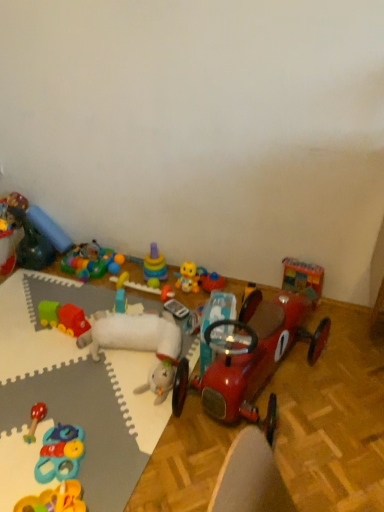
You are a GUI agent. You are given a task and a screenshot of the screen. Output one action in this format:
    pyautogui.click(x=<x>, y=<y>)
    Task: Click on the free spot to the right of wooden rattle at lower left, the seventh toy viewed from the right
    
    Given the screenshot: What is the action you would take?
    pyautogui.click(x=89, y=417)